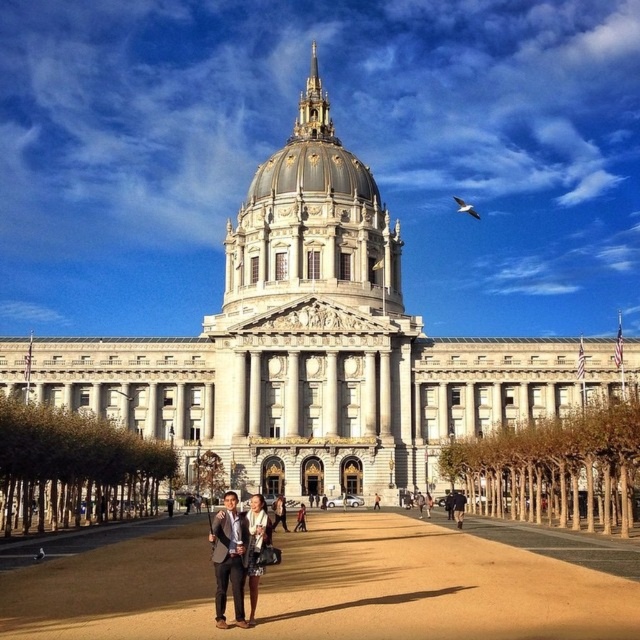
The width and height of the screenshot is (640, 640). Describe the element at coordinates (316, 348) in the screenshot. I see `white marble building at center` at that location.

Between white marble building at center and matte black suit at center, which one has less height?

matte black suit at center is shorter.

Locate an element on the screen. This screenshot has height=640, width=640. white marble building at center is located at coordinates (316, 348).

Is gold/gilded dome at center closer to the viewer compared to dark gray suit at center?

No, it is behind dark gray suit at center.

Does gold/gilded dome at center have a smaller size compared to dark gray suit at center?

No.

Which is behind, point (317, 104) or point (458, 513)?

Positioned behind is point (317, 104).

Locate an element on the screen. This screenshot has width=640, height=640. gold/gilded dome at center is located at coordinates (314, 156).

Between white marble building at center and brown sand at center, which one appears on the left side from the viewer's perspective?

brown sand at center

Is point (330, 120) closer to viewer compared to point (376, 584)?

No, (330, 120) is further to viewer.

Identify the location of white marble building at center. Image resolution: width=640 pixels, height=640 pixels. (316, 348).